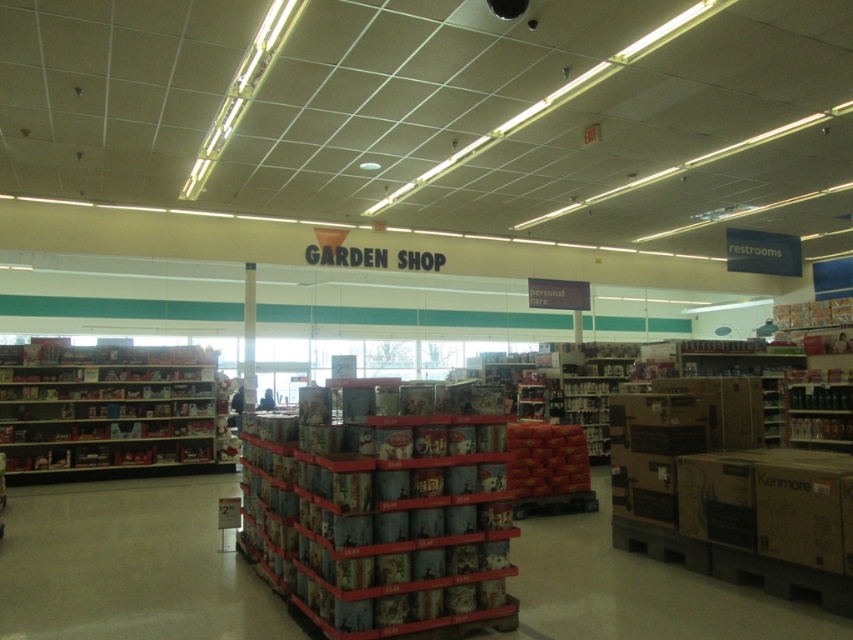
You are a customer in the Garden Shop section of the store. You need to place an order for the metallic silver cans at center and the metallic silver shelves at left. The store requires that items must be within 7 meters of each other to qualify for a bulk discount. Will your order qualify for the discount?

The metallic silver cans at center and metallic silver shelves at left are 7.13 meters apart from each other. Since the required distance for the discount is 7 meters, the items are slightly over the limit, so the order will not qualify for the bulk discount.

You are a store employee who needs to restock the metallic silver cans at center and the metallic silver shelves at left. Based on the space they currently occupy, which item requires more storage space?

The metallic silver shelves at left require more storage space because the metallic silver cans at center occupies less space than them.